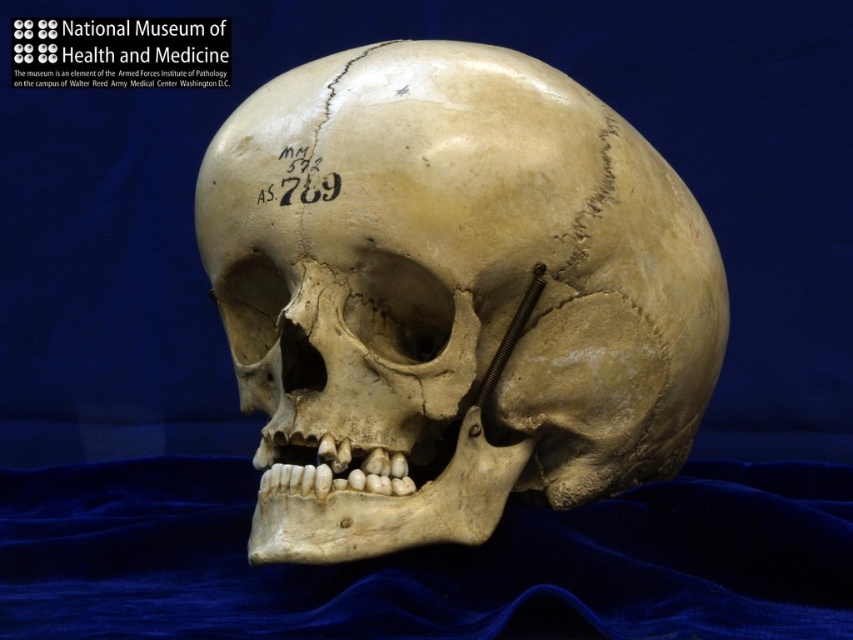
Can you confirm if matte bone skull at center is positioned to the right of black ink label at center?

Yes, matte bone skull at center is to the right of black ink label at center.

Can you confirm if matte bone skull at center is bigger than black ink label at center?

Correct, matte bone skull at center is larger in size than black ink label at center.

I want to click on matte bone skull at center, so click(x=451, y=298).

Can you confirm if white paper text at upper left is smaller than black ink label at center?

Incorrect, white paper text at upper left is not smaller in size than black ink label at center.

Between point (201, 76) and point (267, 184), which one is positioned behind?

The point (201, 76) is more distant.

This screenshot has width=853, height=640. Find the location of `white paper text at upper left`. white paper text at upper left is located at coordinates [x=120, y=52].

Can you confirm if velvet blue cloth at lower center is positioned below white paper text at upper left?

Yes, velvet blue cloth at lower center is below white paper text at upper left.

Does velvet blue cloth at lower center have a larger size compared to white paper text at upper left?

Correct, velvet blue cloth at lower center is larger in size than white paper text at upper left.

Is point (466, 637) closer to camera compared to point (177, 42)?

Yes, it is.

Find the location of a particular element. This screenshot has width=853, height=640. velvet blue cloth at lower center is located at coordinates (425, 561).